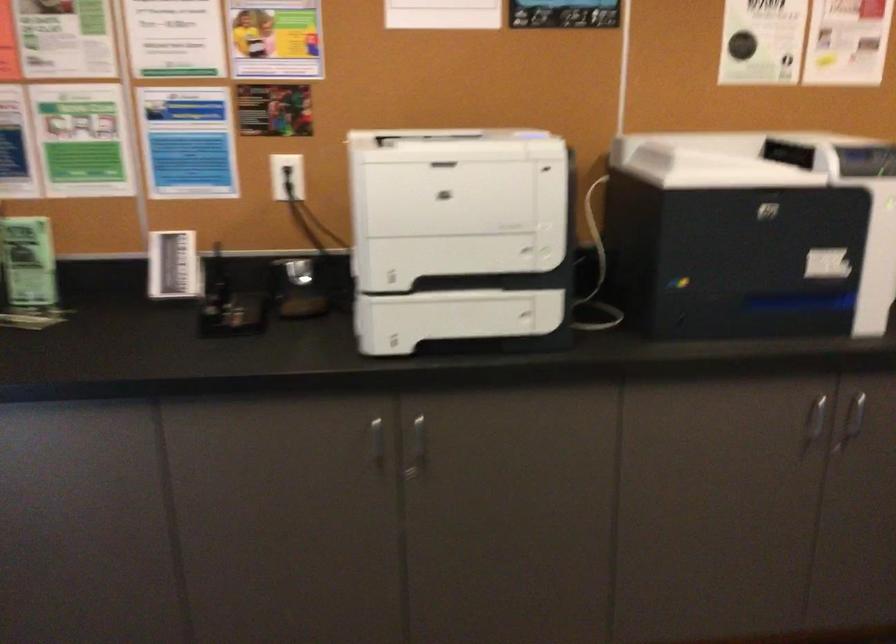
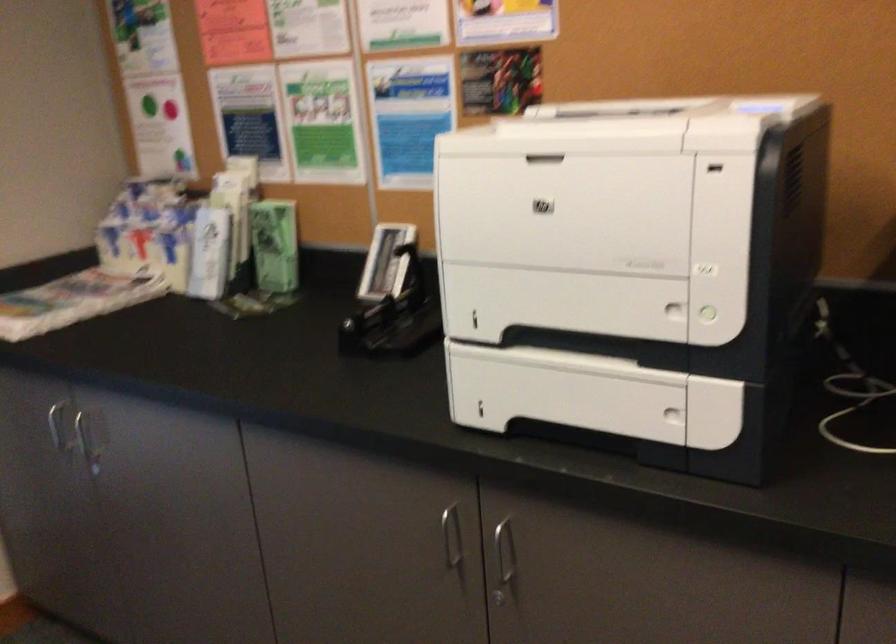
Question: I am providing you with two images of the same scene from different viewpoints. Which of the following objects are not visible in image2?

Choices:
 (A) electrical wall outlet
 (B) green chips bag
 (C) green printer button
 (D) silver cabinet handle

Answer: (A)